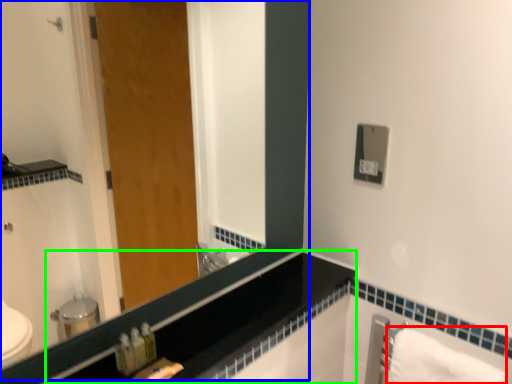
Question: Which is nearer to the bath towel (highlighted by a red box)? mirror (highlighted by a blue box) or counter top (highlighted by a green box).

Choices:
 (A) mirror
 (B) counter top

Answer: (B)